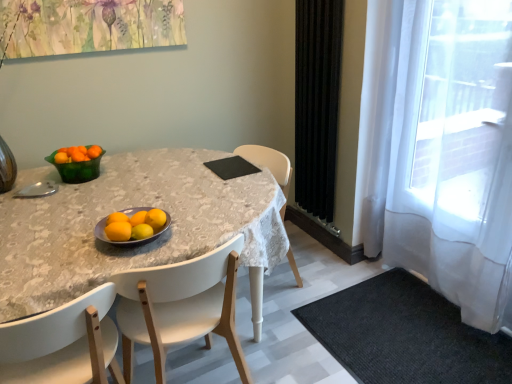
Locate an element on the screen. vacant area to the right of green glass bowl at upper left, which is counted as the first bowl, starting from the back is located at coordinates (130, 172).